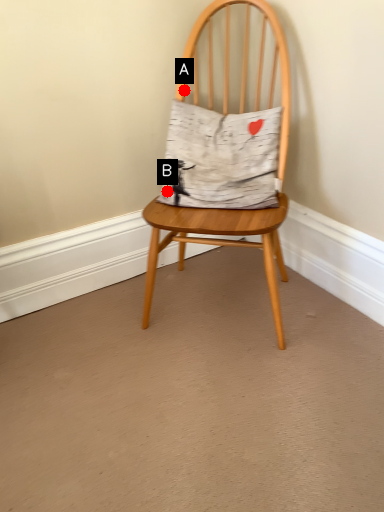
Question: Two points are circled on the image, labeled by A and B beside each circle. Which point is closer to the camera?

Choices:
 (A) A is closer
 (B) B is closer

Answer: (B)